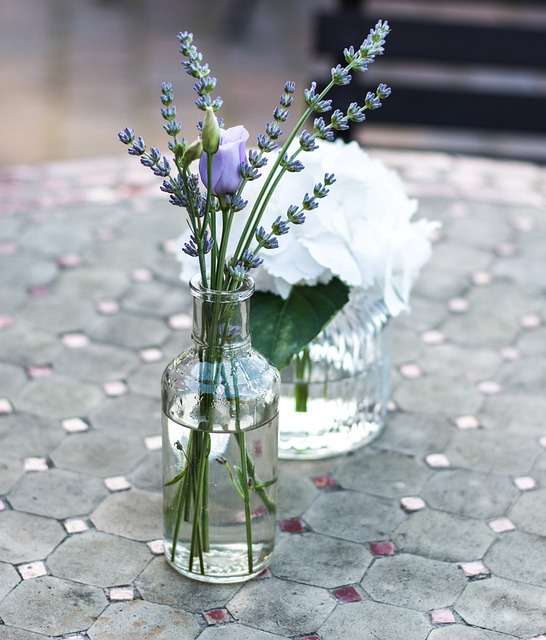
Find the location of `tall glass vase`. tall glass vase is located at coordinates (233, 566).